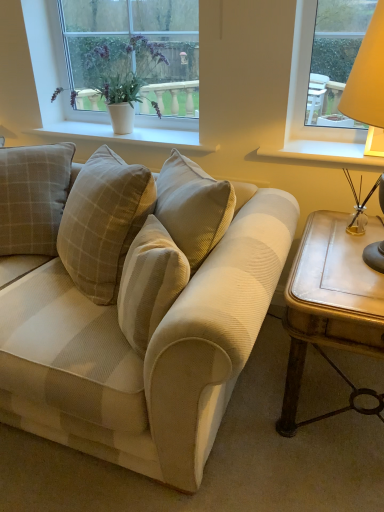
Question: Does beige corduroy pillow at center contain white painted wood at right, acting as the second window sill starting from the left?

Choices:
 (A) no
 (B) yes

Answer: (A)

Question: From the image's perspective, is beige corduroy pillow at center on top of white painted wood at right, the 1th window sill viewed from the right?

Choices:
 (A) no
 (B) yes

Answer: (A)

Question: Does beige corduroy pillow at center come behind white painted wood at right, the 1th window sill viewed from the right?

Choices:
 (A) no
 (B) yes

Answer: (A)

Question: Can you confirm if beige corduroy pillow at center is bigger than white painted wood at right, the 1th window sill viewed from the right?

Choices:
 (A) yes
 (B) no

Answer: (A)

Question: Could you tell me if beige corduroy pillow at center is turned towards white painted wood at right, the 1th window sill viewed from the right?

Choices:
 (A) no
 (B) yes

Answer: (A)

Question: Is matte yellow lampshade at right wider or thinner than white ceramic pot at upper left?

Choices:
 (A) thin
 (B) wide

Answer: (B)

Question: In terms of size, does matte yellow lampshade at right appear bigger or smaller than white ceramic pot at upper left?

Choices:
 (A) small
 (B) big

Answer: (A)

Question: Would you say matte yellow lampshade at right is inside or outside white ceramic pot at upper left?

Choices:
 (A) inside
 (B) outside

Answer: (B)

Question: From a real-world perspective, is matte yellow lampshade at right physically located above or below white ceramic pot at upper left?

Choices:
 (A) below
 (B) above

Answer: (A)

Question: From the image's perspective, is beige corduroy pillow at center above or below matte yellow lampshade at right?

Choices:
 (A) above
 (B) below

Answer: (B)

Question: Relative to matte yellow lampshade at right, is beige corduroy pillow at center in front or behind?

Choices:
 (A) behind
 (B) front

Answer: (A)

Question: Considering the positions of beige corduroy pillow at center and matte yellow lampshade at right in the image, is beige corduroy pillow at center bigger or smaller than matte yellow lampshade at right?

Choices:
 (A) big
 (B) small

Answer: (A)

Question: From a real-world perspective, is beige corduroy pillow at center positioned above or below matte yellow lampshade at right?

Choices:
 (A) above
 (B) below

Answer: (B)

Question: In terms of height, does matte yellow lampshade at right look taller or shorter compared to beige corduroy couch at center?

Choices:
 (A) tall
 (B) short

Answer: (B)

Question: Is matte yellow lampshade at right to the left or to the right of beige corduroy couch at center in the image?

Choices:
 (A) left
 (B) right

Answer: (B)